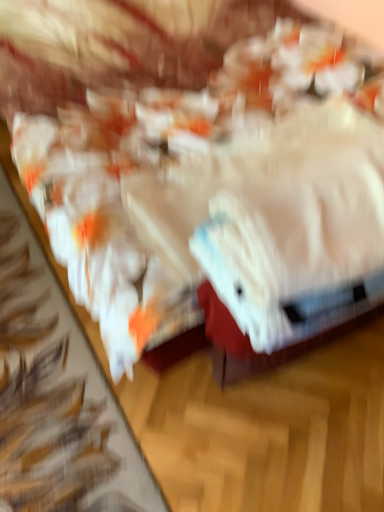
Question: From the image's perspective, is white glossy plastic bag at center positioned above or below white fluffy towel at center?

Choices:
 (A) above
 (B) below

Answer: (A)

Question: Considering the positions of white glossy plastic bag at center and white fluffy towel at center in the image, is white glossy plastic bag at center wider or thinner than white fluffy towel at center?

Choices:
 (A) wide
 (B) thin

Answer: (A)

Question: Would you say white glossy plastic bag at center is to the left or to the right of white fluffy towel at center in the picture?

Choices:
 (A) right
 (B) left

Answer: (B)

Question: Considering the relative positions of white fluffy towel at center and white glossy plastic bag at center in the image provided, is white fluffy towel at center to the left or to the right of white glossy plastic bag at center?

Choices:
 (A) right
 (B) left

Answer: (A)

Question: Which is correct: white fluffy towel at center is inside white glossy plastic bag at center, or outside of it?

Choices:
 (A) inside
 (B) outside

Answer: (A)

Question: Considering the positions of point (336, 141) and point (84, 265), is point (336, 141) closer or farther from the camera than point (84, 265)?

Choices:
 (A) farther
 (B) closer

Answer: (A)

Question: Is white fluffy towel at center wider or thinner than white glossy plastic bag at center?

Choices:
 (A) thin
 (B) wide

Answer: (A)